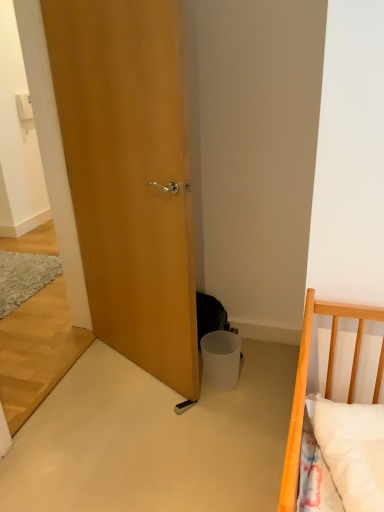
Locate an element on the screen. vacant space in front of wooden door at center is located at coordinates (127, 432).